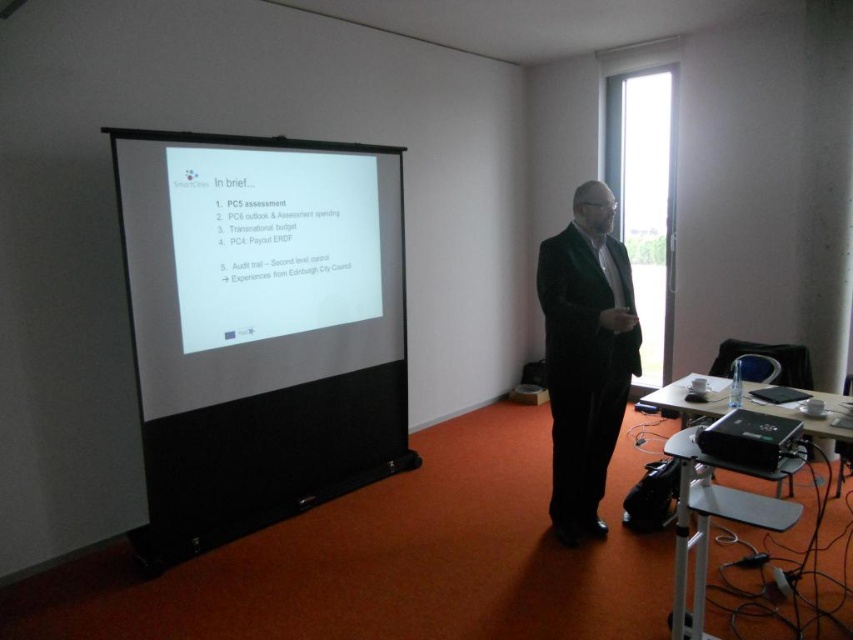
Question: Which object is positioned closest to the black plastic projector at lower right?

Choices:
 (A) white matte projection screen at center
 (B) velvet black suit at center

Answer: (B)

Question: Which object is closer to the camera taking this photo?

Choices:
 (A) white matte projection screen at center
 (B) black plastic projector at lower right

Answer: (B)

Question: Can you confirm if white matte projection screen at center is wider than black plastic projector at lower right?

Choices:
 (A) yes
 (B) no

Answer: (A)

Question: Which point is farther to the camera?

Choices:
 (A) (627, 342)
 (B) (354, 413)

Answer: (B)

Question: Can you confirm if white matte projection screen at center is positioned below black plastic projector at lower right?

Choices:
 (A) no
 (B) yes

Answer: (A)

Question: Is white matte projection screen at center thinner than black plastic projector at lower right?

Choices:
 (A) no
 (B) yes

Answer: (A)